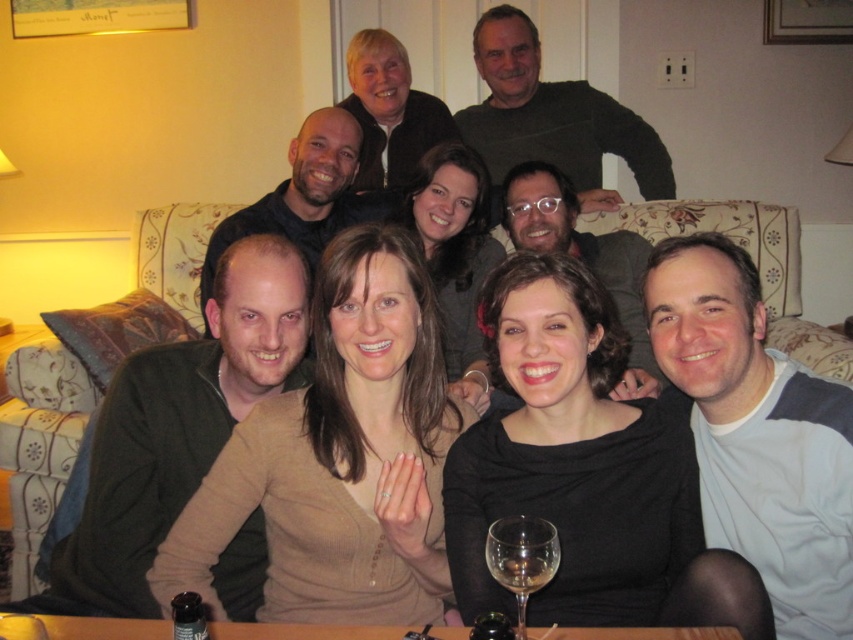
Question: Can you confirm if wooden table at lower center is wider than clear glass wine glass at lower center?

Choices:
 (A) yes
 (B) no

Answer: (A)

Question: Can you confirm if wooden table at lower center is positioned to the right of clear glass wine glass at lower center?

Choices:
 (A) no
 (B) yes

Answer: (A)

Question: Which point is farther to the camera?

Choices:
 (A) (67, 621)
 (B) (531, 577)

Answer: (A)

Question: Which object appears closest to the camera in this image?

Choices:
 (A) clear glass wine glass at lower center
 (B) wooden table at lower center

Answer: (A)

Question: Among these points, which one is nearest to the camera?

Choices:
 (A) (111, 620)
 (B) (498, 561)

Answer: (B)

Question: Can you confirm if wooden table at lower center is wider than clear glass wine glass at lower center?

Choices:
 (A) yes
 (B) no

Answer: (A)